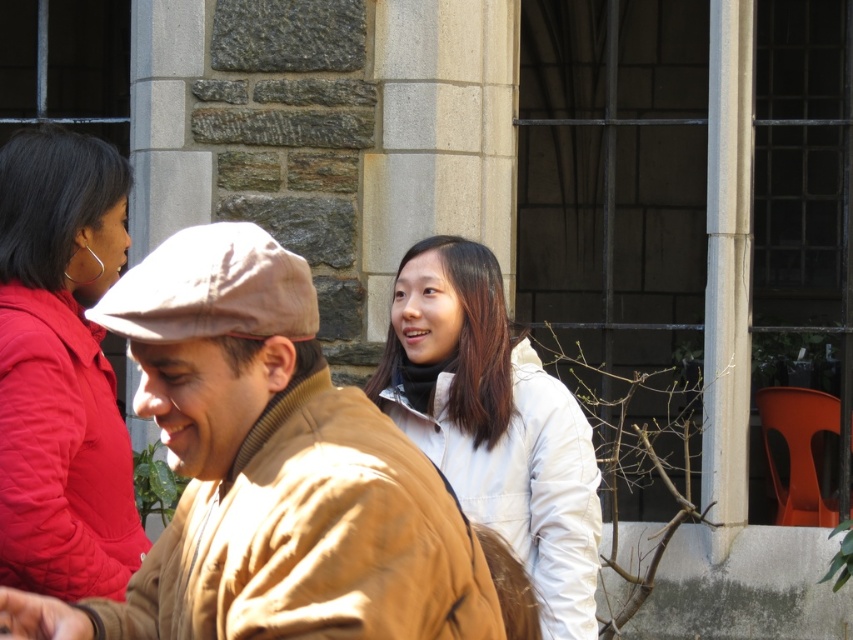
Question: Is quilted red jacket at left bigger than white matte jacket at center?

Choices:
 (A) no
 (B) yes

Answer: (A)

Question: Which object is closer to the camera taking this photo?

Choices:
 (A) white matte jacket at center
 (B) quilted red jacket at left

Answer: (B)

Question: Can you confirm if quilted red jacket at left is bigger than white matte jacket at center?

Choices:
 (A) no
 (B) yes

Answer: (A)

Question: Can you confirm if brown woolen jacket at center is positioned below white matte jacket at center?

Choices:
 (A) no
 (B) yes

Answer: (B)

Question: Which point is farther to the camera?

Choices:
 (A) (74, 292)
 (B) (241, 595)

Answer: (A)

Question: Which point is farther from the camera taking this photo?

Choices:
 (A) (135, 316)
 (B) (15, 204)
 (C) (491, 292)

Answer: (C)